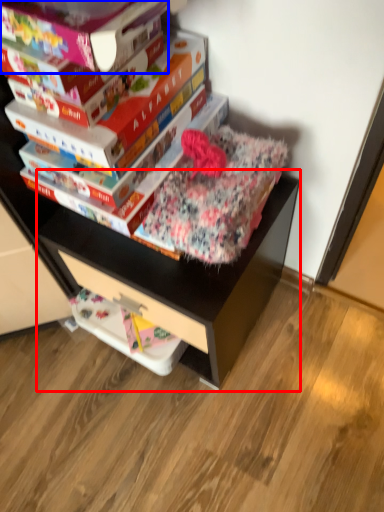
Question: Which object is further to the camera taking this photo, computer desk (highlighted by a red box) or paperback book (highlighted by a blue box)?

Choices:
 (A) computer desk
 (B) paperback book

Answer: (A)